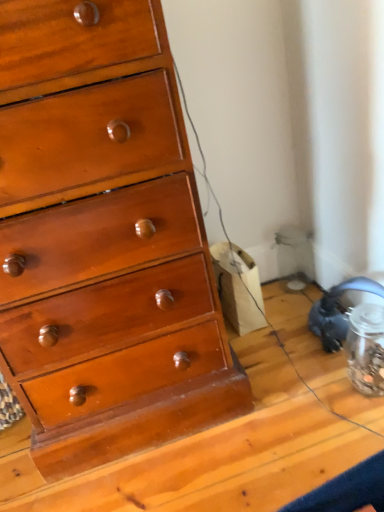
Identify the location of shiny wood chest of drawers at left. This screenshot has width=384, height=512. (103, 239).

This screenshot has width=384, height=512. What do you see at coordinates (103, 239) in the screenshot?
I see `shiny wood chest of drawers at left` at bounding box center [103, 239].

What is the approximate width of shiny wood chest of drawers at left?

shiny wood chest of drawers at left is 19.39 inches in width.

At what (x,y) coordinates should I click in order to perform the action: click on shiny wood chest of drawers at left. Please return your answer as a coordinate pair (x, y). Looking at the image, I should click on (103, 239).